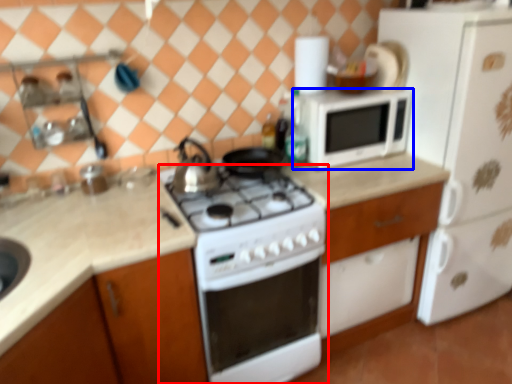
Question: Among these objects, which one is nearest to the camera, home appliance (highlighted by a red box) or microwave oven (highlighted by a blue box)?

Choices:
 (A) home appliance
 (B) microwave oven

Answer: (A)